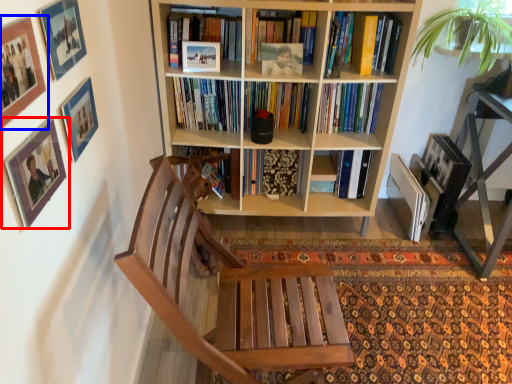
Question: Which of the following is the closest to the observer, picture frame (highlighted by a red box) or picture frame (highlighted by a blue box)?

Choices:
 (A) picture frame
 (B) picture frame

Answer: (B)